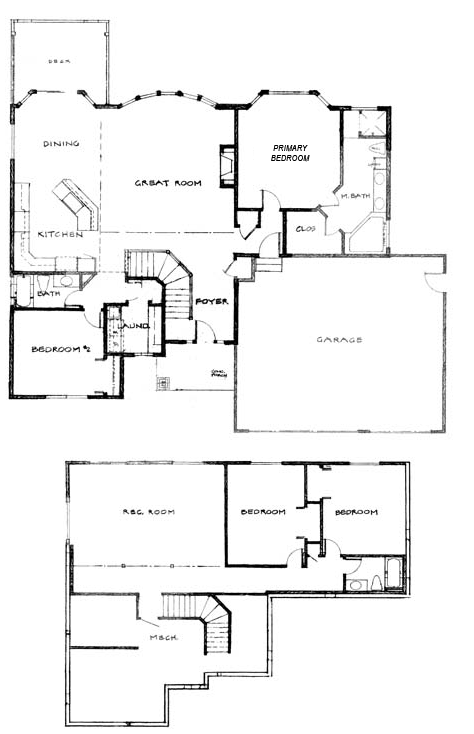
This screenshot has width=474, height=734. Find the location of `master bathroom`. master bathroom is located at coordinates pos(353,194).